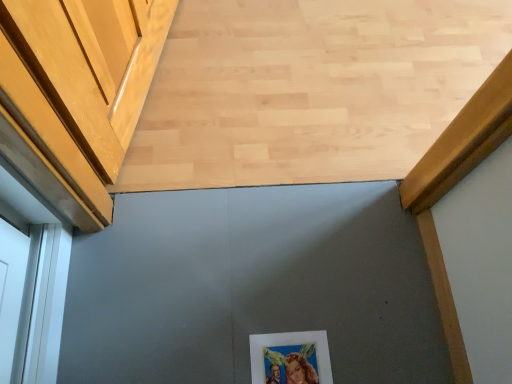
Where is `vacant space situated above natural wood floor at center (from a real-world perspective)`? This screenshot has width=512, height=384. vacant space situated above natural wood floor at center (from a real-world perspective) is located at coordinates (256, 84).